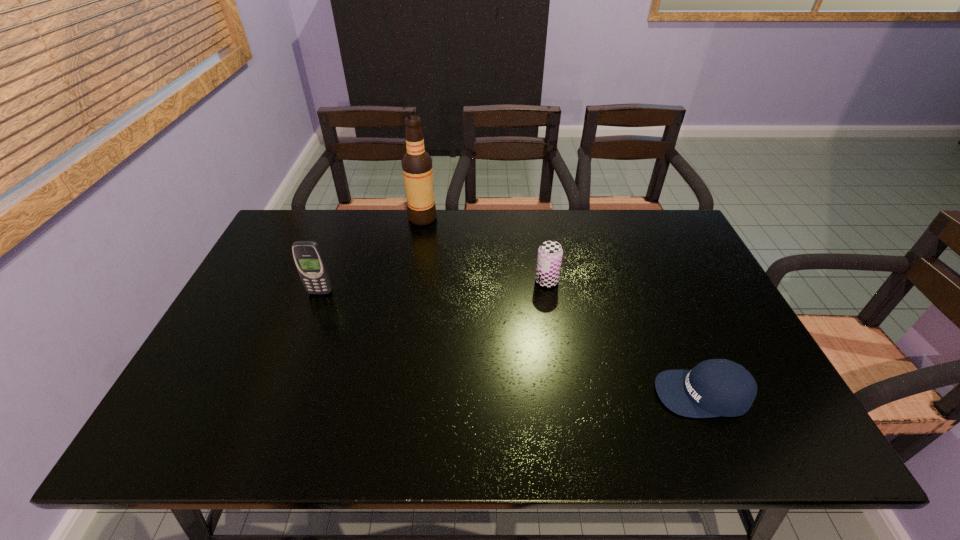
The width and height of the screenshot is (960, 540). I want to click on vacant area that satisfies the following two spatial constraints: 1. on the label of the alcohol; 2. on the left side of the third tallest object, so click(412, 281).

Identify the location of free space that satisfies the following two spatial constraints: 1. on the label of the second farthest object; 2. on the right side of the tallest object. The height and width of the screenshot is (540, 960). (412, 281).

Where is `free spot that satisfies the following two spatial constraints: 1. on the back side of the second shortest object; 2. on the label of the alcohol`? free spot that satisfies the following two spatial constraints: 1. on the back side of the second shortest object; 2. on the label of the alcohol is located at coordinates (537, 218).

Find the location of a particular element. This screenshot has height=540, width=960. free space that satisfies the following two spatial constraints: 1. on the label of the second object from left to right; 2. on the screen of the cellular telephone is located at coordinates [410, 292].